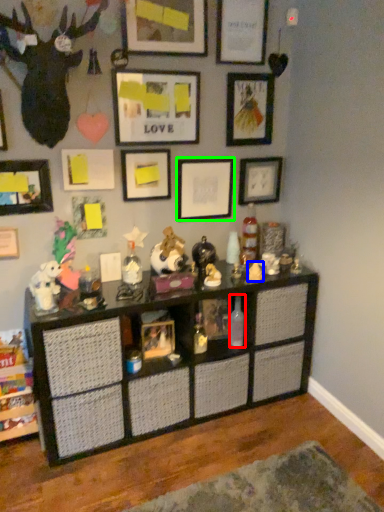
Question: Which is farther away from bottle (highlighted by a red box)? toy (highlighted by a blue box) or picture frame (highlighted by a green box)?

Choices:
 (A) toy
 (B) picture frame

Answer: (B)